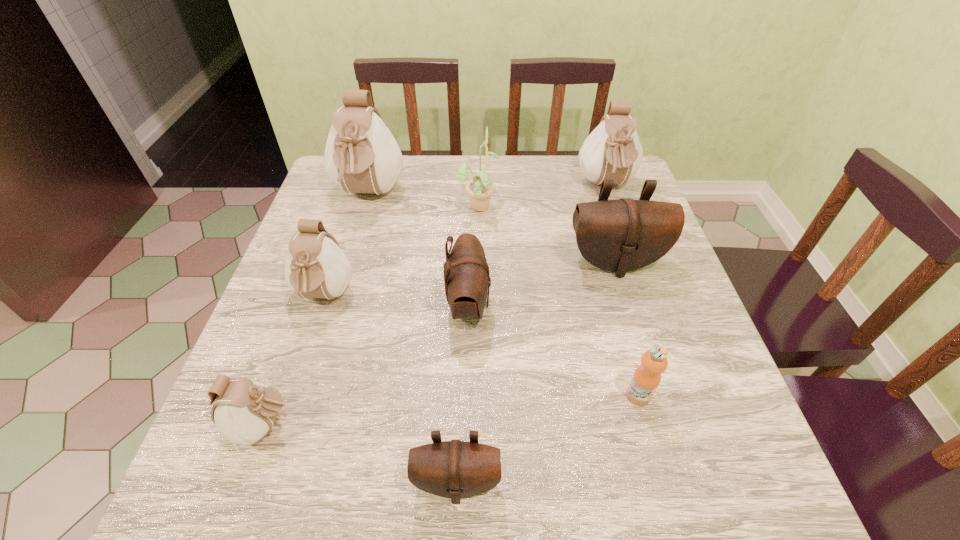
Identify the location of the tallest pouch. This screenshot has height=540, width=960. (361, 155).

I want to click on sunflower, so click(x=480, y=188).

At what (x,y) coordinates should I click in order to perform the action: click on the second biggest white pouch. Please return your answer as a coordinate pair (x, y). The image size is (960, 540). Looking at the image, I should click on (613, 151).

At what (x,y) coordinates should I click in order to perform the action: click on the rightmost brown pouch. Please return your answer as a coordinate pair (x, y). Looking at the image, I should click on (623, 235).

Where is `the second smallest white pouch`? Image resolution: width=960 pixels, height=540 pixels. the second smallest white pouch is located at coordinates (316, 267).

Image resolution: width=960 pixels, height=540 pixels. Find the location of `the second biggest brown pouch`. the second biggest brown pouch is located at coordinates click(x=466, y=273).

Locate an element on the screen. orange juice is located at coordinates (647, 376).

This screenshot has height=540, width=960. In order to click on the nearest white pouch in this screenshot , I will do `click(244, 411)`.

I want to click on the smallest white pouch, so click(x=244, y=411).

The height and width of the screenshot is (540, 960). What are the coordinates of `the nearest pouch` in the screenshot? It's located at (455, 469).